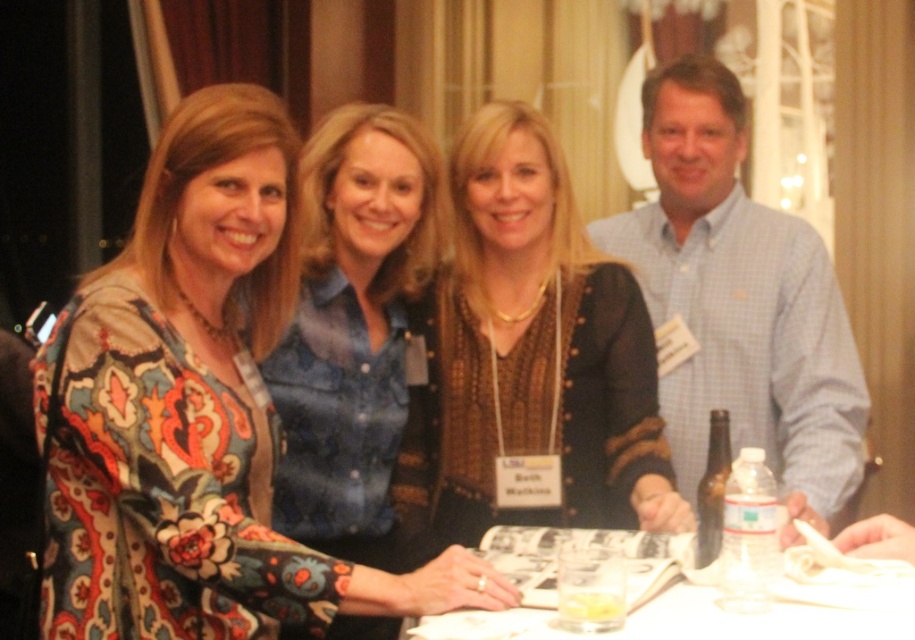
Is floral-patterned dress at center taller than floral-patterned blouse at center?

In fact, floral-patterned dress at center may be shorter than floral-patterned blouse at center.

Does point (168, 291) come closer to viewer compared to point (275, 353)?

Yes, point (168, 291) is closer to viewer.

Describe the element at coordinates (196, 412) in the screenshot. I see `floral-patterned dress at center` at that location.

In order to click on floral-patterned dress at center in this screenshot , I will do `click(196, 412)`.

Is blue checkered shirt at center positioned at the back of floral-patterned blouse at center?

No.

Is point (728, 179) positioned after point (412, 160)?

Yes, point (728, 179) is farther from viewer.

Does point (811, 227) lie behind point (418, 147)?

That is True.

The width and height of the screenshot is (915, 640). I want to click on blue checkered shirt at center, so click(738, 301).

Who is more forward, [418,531] or [835,600]?

Point [835,600]

Who is positioned more to the left, brown textured sweater at center or white paper at center?

brown textured sweater at center

Which is behind, point (525, 250) or point (773, 624)?

Point (525, 250)

Locate an element on the screen. This screenshot has height=640, width=915. brown textured sweater at center is located at coordinates (529, 356).